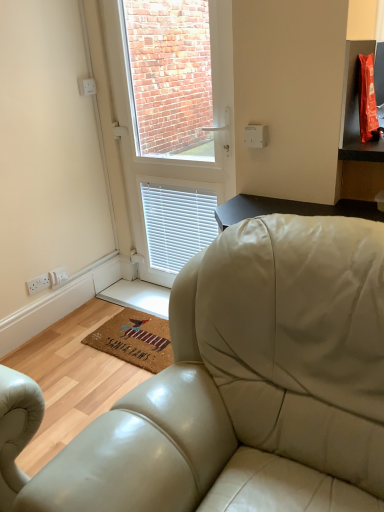
Question: Is brown coir mat at lower center taller or shorter than white plastic window at center?

Choices:
 (A) tall
 (B) short

Answer: (B)

Question: Is brown coir mat at lower center bigger or smaller than white plastic window at center?

Choices:
 (A) small
 (B) big

Answer: (A)

Question: Estimate the real-world distances between objects in this image. Which object is closer to the white plastic window at center?

Choices:
 (A) white plastic socket at lower left
 (B) brown coir mat at lower center

Answer: (B)

Question: Estimate the real-world distances between objects in this image. Which object is farther from the white plastic window at center?

Choices:
 (A) brown coir mat at lower center
 (B) white plastic socket at lower left

Answer: (B)